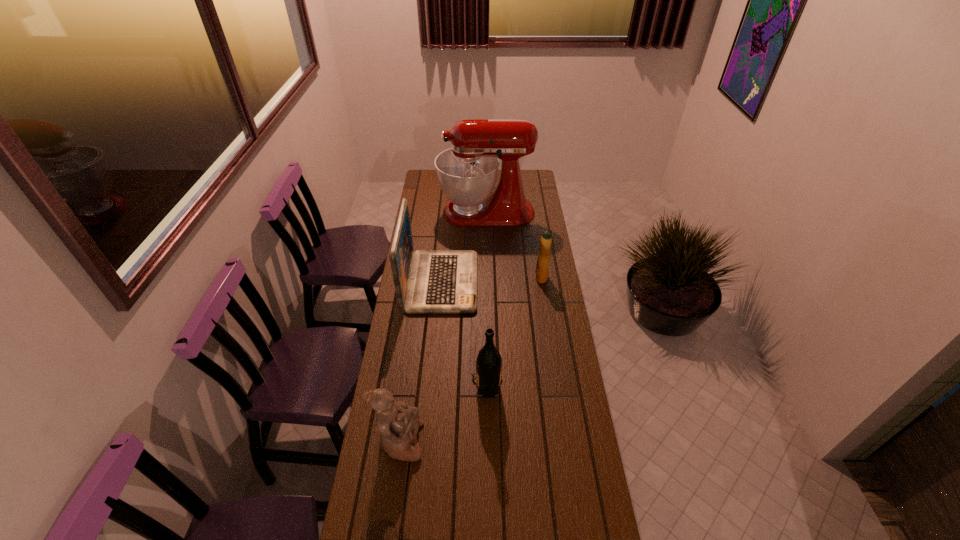
This screenshot has width=960, height=540. Find the location of `vacant space at the far left corner of the desktop`. vacant space at the far left corner of the desktop is located at coordinates (422, 178).

I want to click on free space between the detergent and the fourth farthest object, so click(514, 331).

Identify which object is the nearest to the tallest object. Please provide its 2D coordinates. Your answer should be formatted as a tuple, i.e. [(x, y)], where the tuple contains the x and y coordinates of a point satisfying the conditions above.

[(426, 281)]

This screenshot has height=540, width=960. Identify the location of object that is the second closest to the farthest object. (542, 264).

I want to click on vacant space that satisfies the following two spatial constraints: 1. on the back side of the second nearest object; 2. on the screen of the laptop computer, so click(x=486, y=282).

At what (x,y) coordinates should I click in order to perform the action: click on vacant position in the image that satisfies the following two spatial constraints: 1. at the attachment hub of the mixer; 2. on the front side of the wine bottle. Please return your answer as a coordinate pair (x, y). Image resolution: width=960 pixels, height=540 pixels. Looking at the image, I should click on (490, 385).